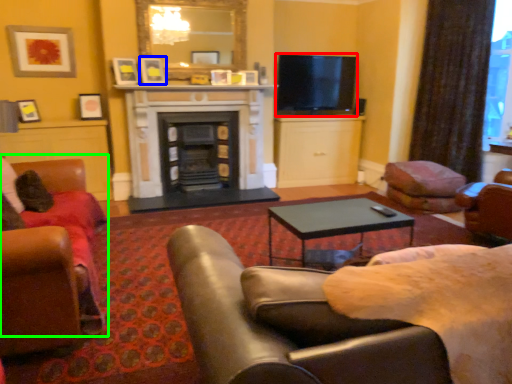
Question: Which is nearer to the television (highlighted by a red box)? picture frame (highlighted by a blue box) or chair (highlighted by a green box).

Choices:
 (A) picture frame
 (B) chair

Answer: (A)